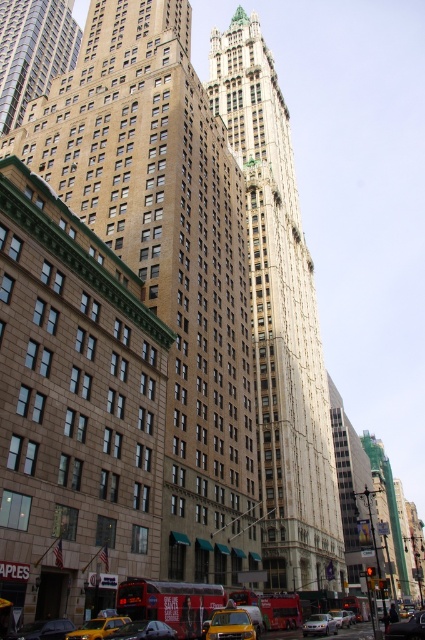
Question: From the image, what is the correct spatial relationship of brown stone building at center in relation to yellow matte taxi at lower center?

Choices:
 (A) above
 (B) below

Answer: (A)

Question: Which of the following is the closest to the observer?

Choices:
 (A) pos(181,355)
 (B) pos(226,628)

Answer: (B)

Question: Estimate the real-world distances between objects in this image. Which object is closer to the yellow rubber car at lower center?

Choices:
 (A) yellow matte taxi at lower left
 (B) brown stone building at upper left

Answer: (A)

Question: Which of the following is the farthest from the observer?

Choices:
 (A) (192, 330)
 (B) (342, 618)
 (C) (116, 620)

Answer: (B)

Question: Is metallic silver car at lower center wider than yellow matte taxi at lower left?

Choices:
 (A) yes
 (B) no

Answer: (B)

Question: Is white stone tower at center thinner than yellow rubber car at lower center?

Choices:
 (A) no
 (B) yes

Answer: (A)